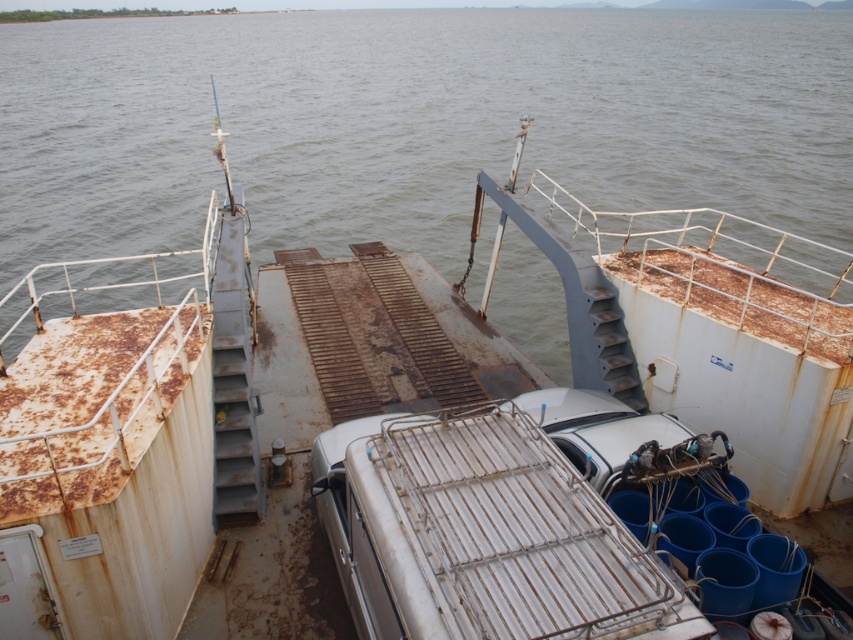
Consider the image. You are standing on the ferry deck and want to move from point [221,36] to point [642,408]. Since the deck is made of metal grating, which might be slippery when wet, will you need to take extra caution while moving towards the latter point?

Yes, you need to take extra caution because point [642,408] is further away from you than point [221,36], and the wet metal grating deck could be slippery, increasing the risk of slipping as you move towards it.

You are a passenger on the ferry and want to avoid stepping on the rusty water at center. Where should you walk to stay on the white matte boat at center?

The rusty water at center is positioned over the white matte boat at center, so stepping on the white matte boat at center would mean also stepping on the rusty water at center. You cannot avoid it.

You are a passenger on the ferry and want to walk from the front of the ferry to the back. You see the rusty water at center and the white matte boat at center. Which object will you pass first?

The white matte boat at center is behind rusty water at center, so you will pass the rusty water at center first before reaching the white matte boat at center.